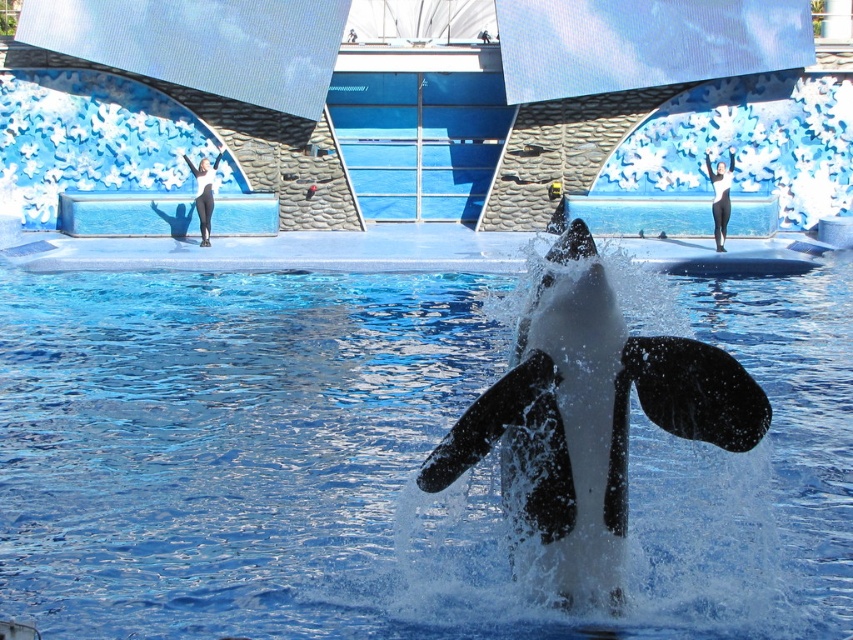
Which of these two, clear blue water at center or black smooth whale at center, stands taller?

clear blue water at center

What do you see at coordinates (387, 460) in the screenshot? This screenshot has width=853, height=640. I see `clear blue water at center` at bounding box center [387, 460].

Which is in front, point (334, 467) or point (662, 412)?

Positioned in front is point (662, 412).

Identify the location of clear blue water at center. This screenshot has width=853, height=640. (387, 460).